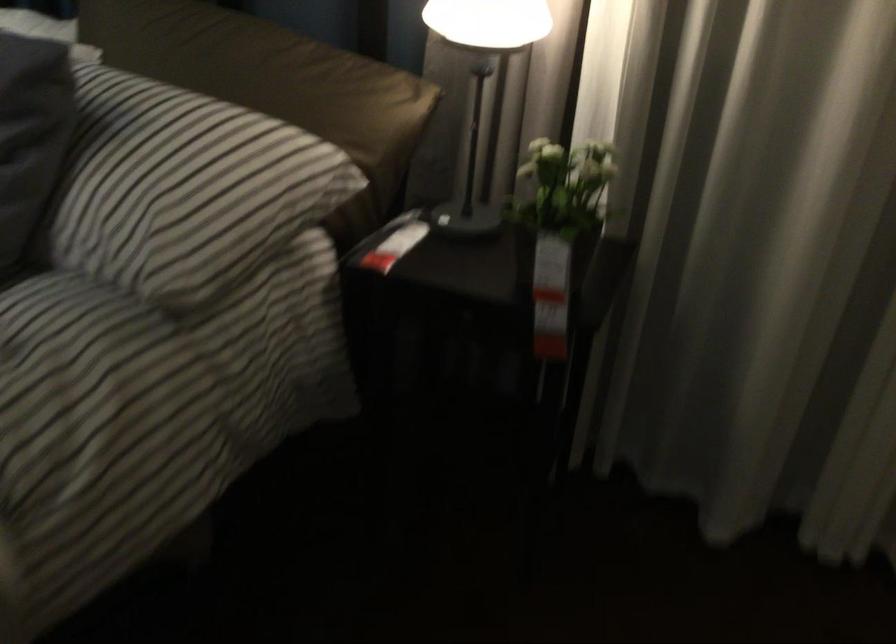
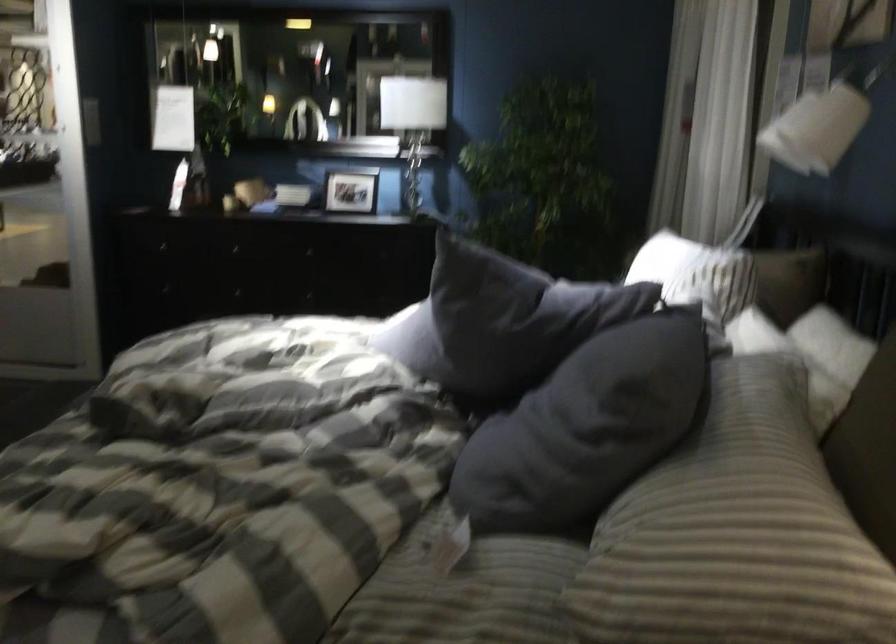
Question: The camera is either moving clockwise (left) or counter-clockwise (right) around the object. The first image is from the beginning of the video and the second image is from the end. Is the camera moving left or right when shooting the video?

Choices:
 (A) Left
 (B) Right

Answer: (B)